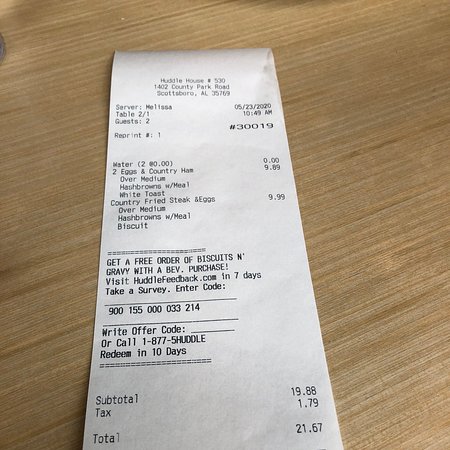
Find the location of a particular element. The width and height of the screenshot is (450, 450). dark wood grain is located at coordinates (60, 334), (74, 417), (366, 324).